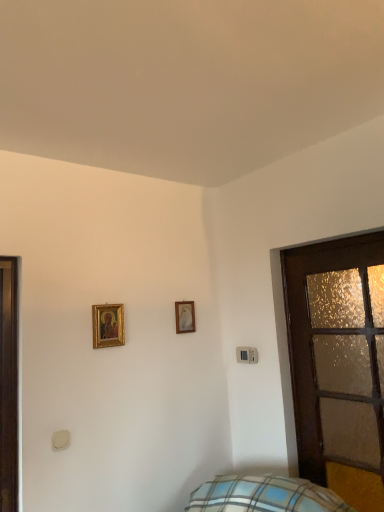
Question: Does wooden frosted glass door at right have a lesser width compared to gold-framed picture at upper left, placed as the 2th picture frame when sorted from back to front?

Choices:
 (A) yes
 (B) no

Answer: (B)

Question: From a real-world perspective, is wooden frosted glass door at right under gold-framed picture at upper left, the first picture frame when ordered from front to back?

Choices:
 (A) yes
 (B) no

Answer: (A)

Question: Considering the relative positions of wooden frosted glass door at right and gold-framed picture at upper left, which is the 1th picture frame from left to right, in the image provided, is wooden frosted glass door at right in front of gold-framed picture at upper left, which is the 1th picture frame from left to right,?

Choices:
 (A) yes
 (B) no

Answer: (A)

Question: Considering the relative positions of wooden frosted glass door at right and gold-framed picture at upper left, placed as the 2th picture frame when sorted from back to front, in the image provided, is wooden frosted glass door at right to the right of gold-framed picture at upper left, placed as the 2th picture frame when sorted from back to front, from the viewer's perspective?

Choices:
 (A) yes
 (B) no

Answer: (A)

Question: Is wooden frosted glass door at right turned away from gold-framed picture at upper left, placed as the 2th picture frame when sorted from back to front?

Choices:
 (A) yes
 (B) no

Answer: (B)

Question: Considering the positions of gold-framed picture at upper left, the first picture frame when ordered from front to back, and wooden frosted glass door at right in the image, is gold-framed picture at upper left, the first picture frame when ordered from front to back, wider or thinner than wooden frosted glass door at right?

Choices:
 (A) thin
 (B) wide

Answer: (A)

Question: Is gold-framed picture at upper left, the 2th picture frame positioned from the right, taller or shorter than wooden frosted glass door at right?

Choices:
 (A) tall
 (B) short

Answer: (B)

Question: From the image's perspective, is gold-framed picture at upper left, the first picture frame when ordered from front to back, above or below wooden frosted glass door at right?

Choices:
 (A) above
 (B) below

Answer: (A)

Question: Relative to wooden frosted glass door at right, is gold-framed picture at upper left, the first picture frame when ordered from front to back, in front or behind?

Choices:
 (A) front
 (B) behind

Answer: (B)

Question: Is wooden frosted glass door at right in front of or behind gold-framed picture at upper center, which is counted as the first picture frame, starting from the back, in the image?

Choices:
 (A) behind
 (B) front

Answer: (B)

Question: Is wooden frosted glass door at right to the left or to the right of gold-framed picture at upper center, which appears as the second picture frame when viewed from the left, in the image?

Choices:
 (A) left
 (B) right

Answer: (B)

Question: Which is correct: wooden frosted glass door at right is inside gold-framed picture at upper center, which is counted as the first picture frame, starting from the back, or outside of it?

Choices:
 (A) inside
 (B) outside

Answer: (B)

Question: Considering the positions of point (286, 279) and point (183, 330), is point (286, 279) closer or farther from the camera than point (183, 330)?

Choices:
 (A) closer
 (B) farther

Answer: (A)

Question: Is gold-framed picture at upper center, the 1th picture frame in the right-to-left sequence, to the left or to the right of gold-framed picture at upper left, placed as the 2th picture frame when sorted from back to front, in the image?

Choices:
 (A) right
 (B) left

Answer: (A)

Question: From a real-world perspective, is gold-framed picture at upper center, the 1th picture frame in the right-to-left sequence, physically located above or below gold-framed picture at upper left, placed as the 2th picture frame when sorted from back to front?

Choices:
 (A) above
 (B) below

Answer: (A)